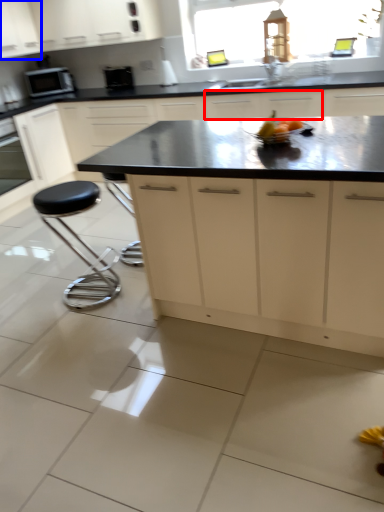
Question: Which of the following is the farthest to the observer, cabinetry (highlighted by a red box) or cabinetry (highlighted by a blue box)?

Choices:
 (A) cabinetry
 (B) cabinetry

Answer: (B)